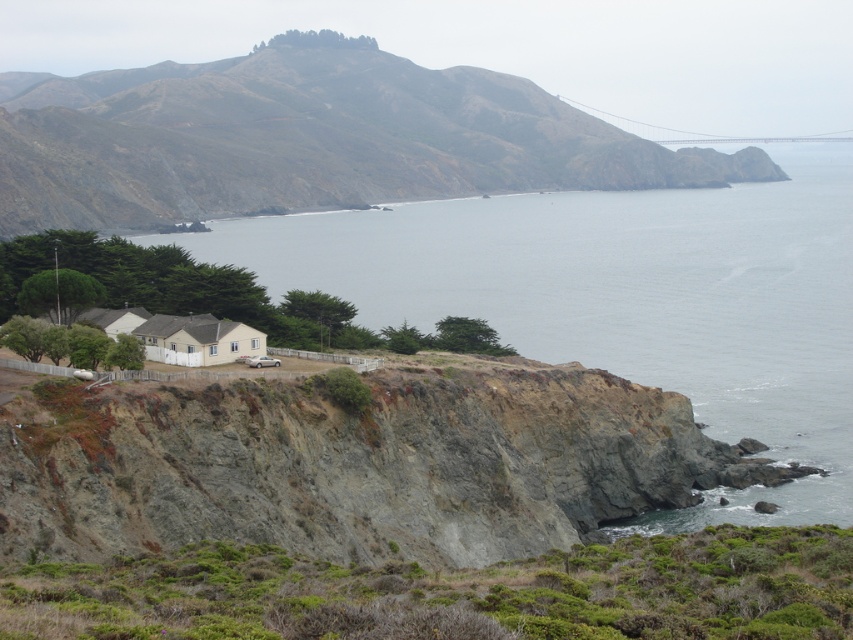
Who is lower down, rugged brown cliff at upper left or metallic gray bridge at upper right?

rugged brown cliff at upper left is lower down.

The height and width of the screenshot is (640, 853). I want to click on rugged brown cliff at upper left, so click(306, 138).

I want to click on gray water at center, so click(624, 300).

Can you confirm if gray water at center is positioned to the right of metallic gray bridge at upper right?

Incorrect, gray water at center is not on the right side of metallic gray bridge at upper right.

Is point (637, 353) behind point (604, 115)?

No, it is in front of (604, 115).

This screenshot has width=853, height=640. In order to click on gray water at center in this screenshot , I will do `click(624, 300)`.

Does gray water at center have a lesser height compared to rugged brown cliff at upper left?

Yes, gray water at center is shorter than rugged brown cliff at upper left.

Is gray water at center positioned before rugged brown cliff at upper left?

Yes.

Is point (705, 221) closer to viewer compared to point (374, 193)?

Yes, point (705, 221) is in front of point (374, 193).

Find the location of `gray water at center`. gray water at center is located at coordinates (624, 300).